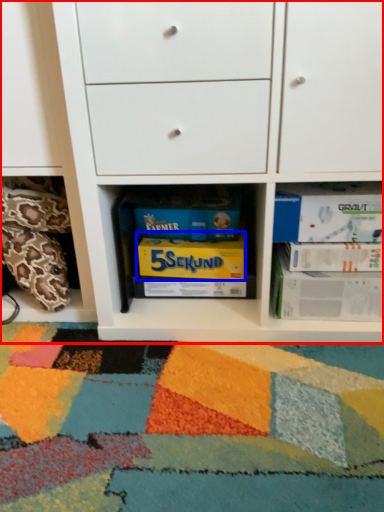
Question: Which point is closer to the camera, chest of drawers (highlighted by a red box) or paperback book (highlighted by a blue box)?

Choices:
 (A) chest of drawers
 (B) paperback book

Answer: (A)